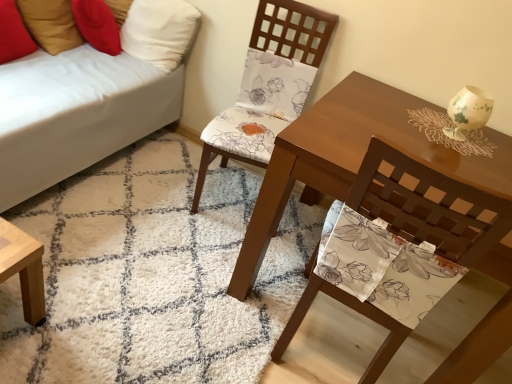
Where is `unoccupied area in front of matte floral fabric chair at center, marked as the 2th chair in a front-to-back arrangement`? Image resolution: width=512 pixels, height=384 pixels. unoccupied area in front of matte floral fabric chair at center, marked as the 2th chair in a front-to-back arrangement is located at coordinates pyautogui.click(x=188, y=249).